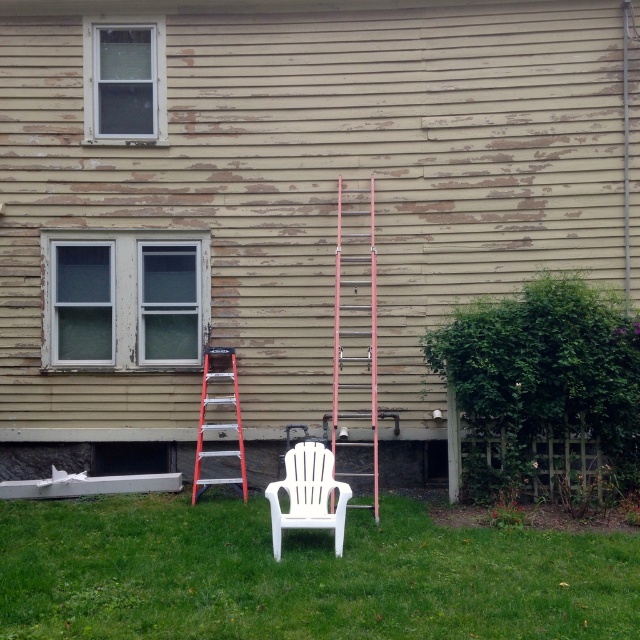
Question: Does green grass at center have a smaller size compared to rustic wood ladder at center?

Choices:
 (A) no
 (B) yes

Answer: (B)

Question: Is rustic wood ladder at center behind metallic silver ladder at left?

Choices:
 (A) yes
 (B) no

Answer: (B)

Question: Estimate the real-world distances between objects in this image. Which object is closer to the white plastic chair at center?

Choices:
 (A) rustic wood ladder at center
 (B) metallic silver ladder at left

Answer: (B)

Question: Considering the relative positions of rustic wood ladder at center and white plastic chair at center in the image provided, where is rustic wood ladder at center located with respect to white plastic chair at center?

Choices:
 (A) right
 (B) left

Answer: (A)

Question: Which of the following is the farthest from the observer?

Choices:
 (A) green grass at center
 (B) rustic wood ladder at center
 (C) white plastic chair at center

Answer: (B)

Question: Which object appears farthest from the camera in this image?

Choices:
 (A) white plastic chair at center
 (B) metallic silver ladder at left
 (C) rustic wood ladder at center

Answer: (B)